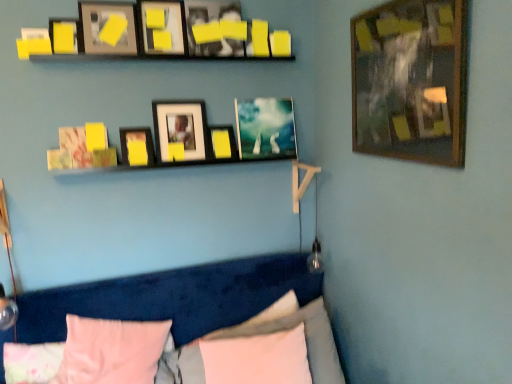
Question: From a real-world perspective, is yellow matte picture frame at upper center, placed as the 6th picture frame when sorted from right to left, positioned above or below yellow matte picture frame at upper center, which appears as the 8th picture frame when viewed from the left?

Choices:
 (A) below
 (B) above

Answer: (B)

Question: From their relative heights in the image, would you say yellow matte picture frame at upper center, placed as the 6th picture frame when sorted from right to left, is taller or shorter than yellow matte picture frame at upper center, which ranks as the third picture frame in right-to-left order?

Choices:
 (A) tall
 (B) short

Answer: (A)

Question: Which object is positioned farthest from the white soft pillow at lower center, the 4th pillow viewed from the left?

Choices:
 (A) matte black picture frame at upper center, the 4th picture frame viewed from the right
 (B) matte black picture frame at upper center, which is the eighth picture frame from right to left
 (C) metallic silver picture frame at center, the ninth picture frame positioned from the left
 (D) pink fabric pillow at lower center, which is counted as the first pillow, starting from the right
 (E) yellow matte picture frame at upper center, acting as the fifth picture frame starting from the left

Answer: (B)

Question: Which object is positioned closest to the matte yellow picture frame at upper left, placed as the 1th picture frame when sorted from left to right?

Choices:
 (A) matte black picture frame at upper center, the 7th picture frame positioned from the right
 (B) pink fabric pillow at lower left, which is the second pillow from left to right
 (C) metallic silver picture frame at center, the ninth picture frame positioned from the left
 (D) yellow matte picture frame at upper center, placed as the 6th picture frame when sorted from right to left
 (E) yellow matte picture frame at upper center, which ranks as the third picture frame in right-to-left order

Answer: (D)